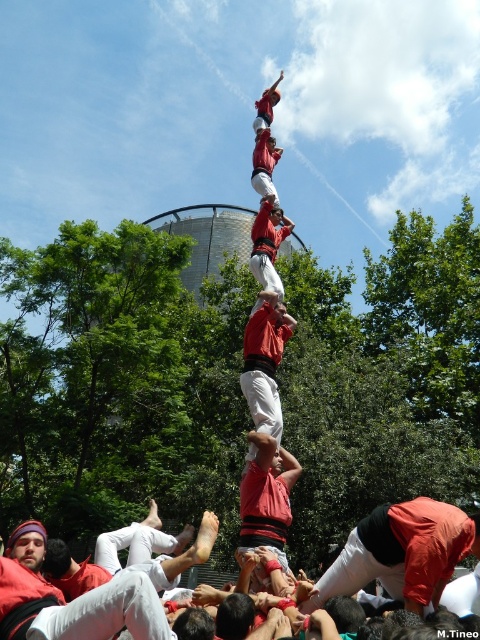
Question: Considering the real-world distances, which object is farthest from the red fabric-clad person at center?

Choices:
 (A) red fabric man at lower right
 (B) matte red shirt at center
 (C) matte white pants at lower left

Answer: (C)

Question: Where is red fabric man at lower right located in relation to matte white pants at lower left in the image?

Choices:
 (A) below
 (B) above

Answer: (B)

Question: Which point is farther to the camera?

Choices:
 (A) (14, 618)
 (B) (422, 580)
 (C) (259, 269)

Answer: (C)

Question: Is red fabric man at lower right thinner than matte red shirt at center?

Choices:
 (A) no
 (B) yes

Answer: (A)

Question: Is red fabric shirt at center behind matte red shirt at center?

Choices:
 (A) yes
 (B) no

Answer: (B)

Question: Among these objects, which one is nearest to the camera?

Choices:
 (A) matte white pants at lower left
 (B) red fabric-clad person at center
 (C) red fabric shirt at center
 (D) red fabric man at lower right

Answer: (A)